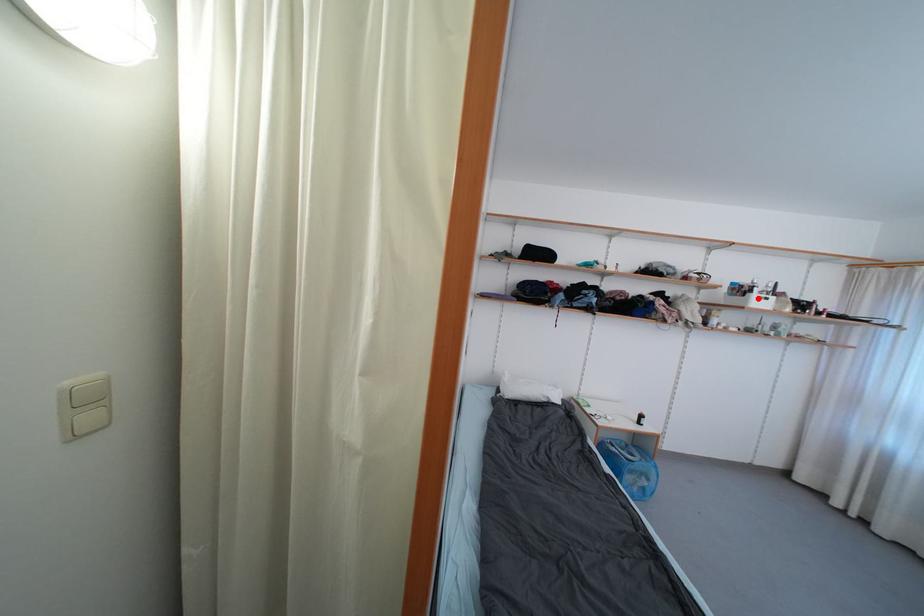
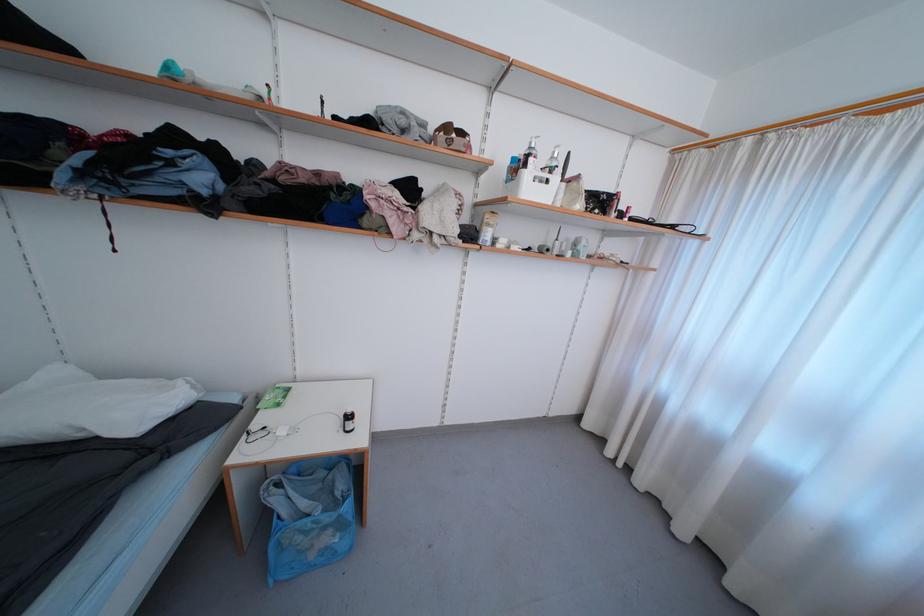
Find the pixel in the second image that matches the highlighted location in the first image.

(531, 177)